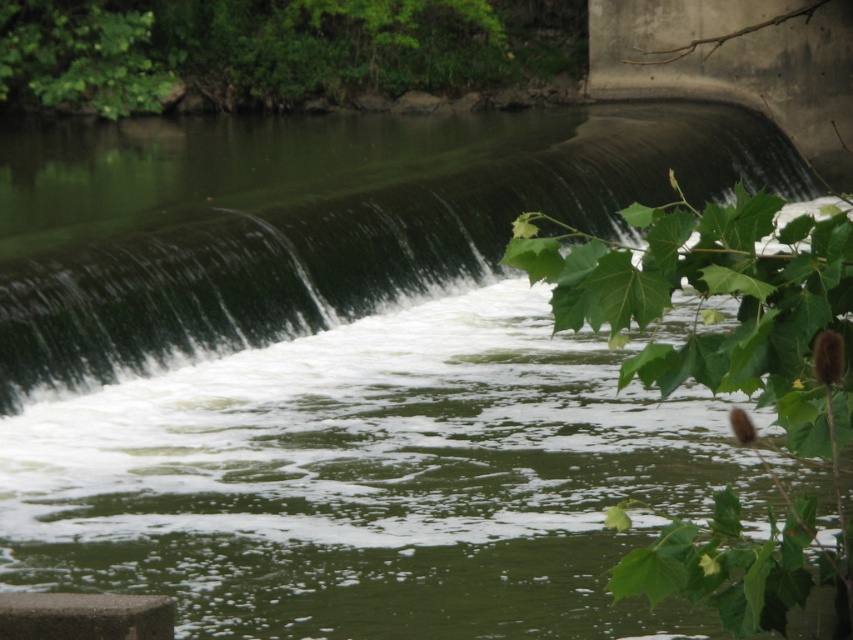
Question: Among these points, which one is farthest from the camera?

Choices:
 (A) (19, 388)
 (B) (688, 340)

Answer: (A)

Question: Which point appears farthest from the camera in this image?

Choices:
 (A) (807, 593)
 (B) (491, 252)

Answer: (B)

Question: Does green smooth water at center lie behind green leafy plant at upper right?

Choices:
 (A) yes
 (B) no

Answer: (A)

Question: Is green smooth water at center bigger than green leafy plant at upper right?

Choices:
 (A) no
 (B) yes

Answer: (B)

Question: Is green smooth water at center smaller than green leafy plant at upper right?

Choices:
 (A) no
 (B) yes

Answer: (A)